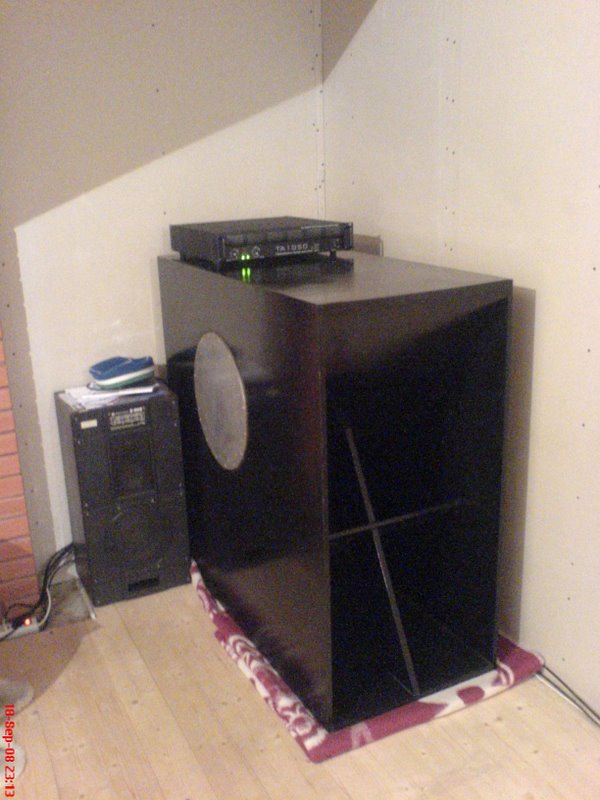
Where is `cords`? cords is located at coordinates (65, 560), (50, 556), (60, 556).